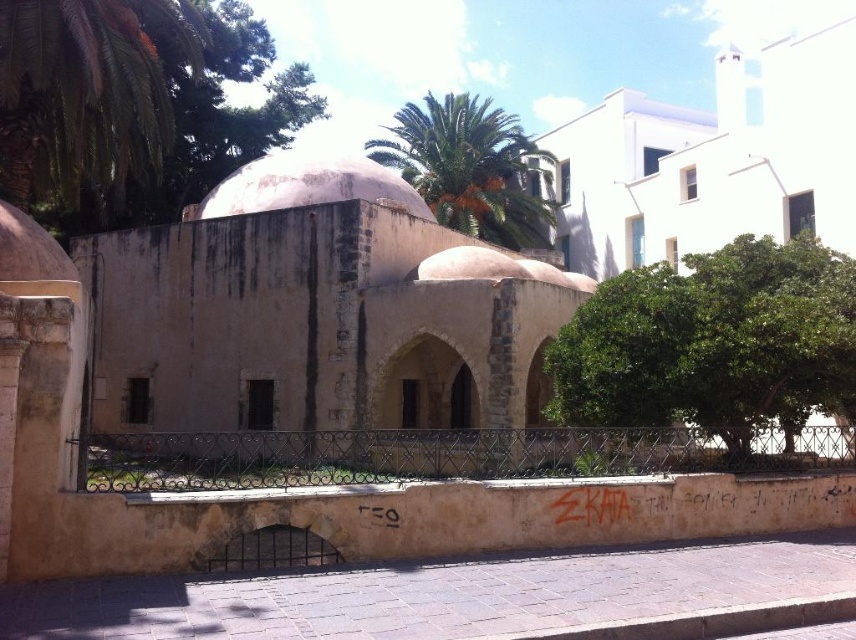
Question: Can you confirm if green leafy palm tree at upper left is positioned below white matte dome at center?

Choices:
 (A) yes
 (B) no

Answer: (B)

Question: Based on their relative distances, which object is nearer to the green leafy palm tree at upper left?

Choices:
 (A) white matte dome at center
 (B) green leafy palm tree at center

Answer: (A)

Question: Which of the following is the farthest from the observer?

Choices:
 (A) white matte dome at center
 (B) green leafy palm tree at center
 (C) green leafy palm tree at upper left

Answer: (B)

Question: Which object is farther from the camera taking this photo?

Choices:
 (A) green leafy palm tree at center
 (B) white matte dome at center
 (C) green leafy palm tree at upper left

Answer: (A)

Question: Is green leafy palm tree at upper left positioned at the back of white matte dome at center?

Choices:
 (A) no
 (B) yes

Answer: (A)

Question: Is green leafy palm tree at center behind white matte dome at center?

Choices:
 (A) no
 (B) yes

Answer: (B)